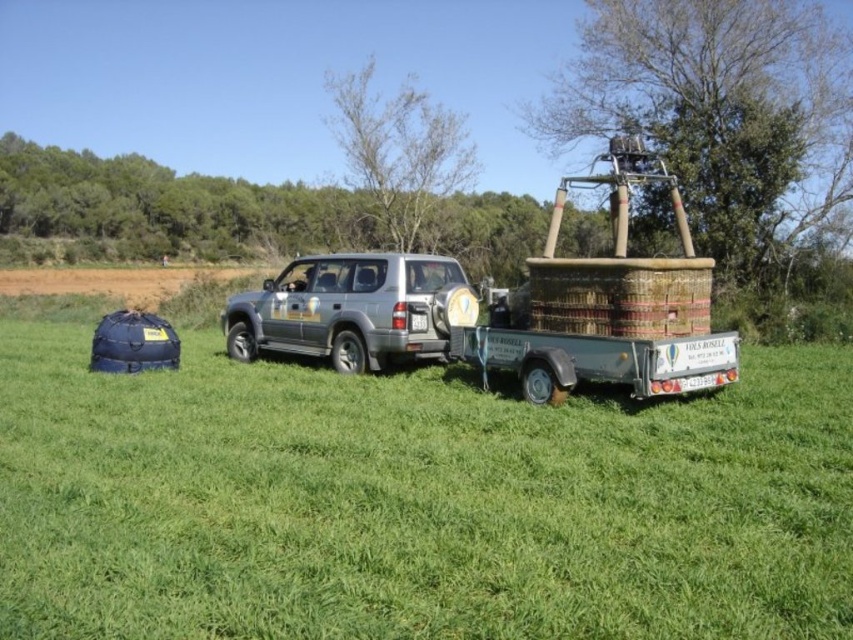
Question: Which point appears farthest from the camera in this image?

Choices:
 (A) (239, 570)
 (B) (341, 324)

Answer: (B)

Question: Can you confirm if green grassy field at center is thinner than silver metallic suv at center?

Choices:
 (A) no
 (B) yes

Answer: (A)

Question: Does green grassy field at center have a smaller size compared to silver metallic suv at center?

Choices:
 (A) yes
 (B) no

Answer: (B)

Question: Which of the following is the farthest from the observer?

Choices:
 (A) green grassy field at center
 (B) silver metallic suv at center

Answer: (B)

Question: Observing the image, what is the correct spatial positioning of green grassy field at center in reference to silver metallic suv at center?

Choices:
 (A) left
 (B) right

Answer: (B)